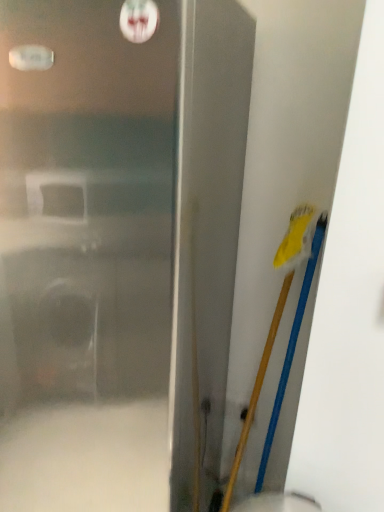
What do you see at coordinates (118, 246) in the screenshot?
I see `metallic gray door at center` at bounding box center [118, 246].

Where is `metallic gray door at center`? The image size is (384, 512). metallic gray door at center is located at coordinates (118, 246).

The height and width of the screenshot is (512, 384). In order to click on metallic gray door at center in this screenshot , I will do `click(118, 246)`.